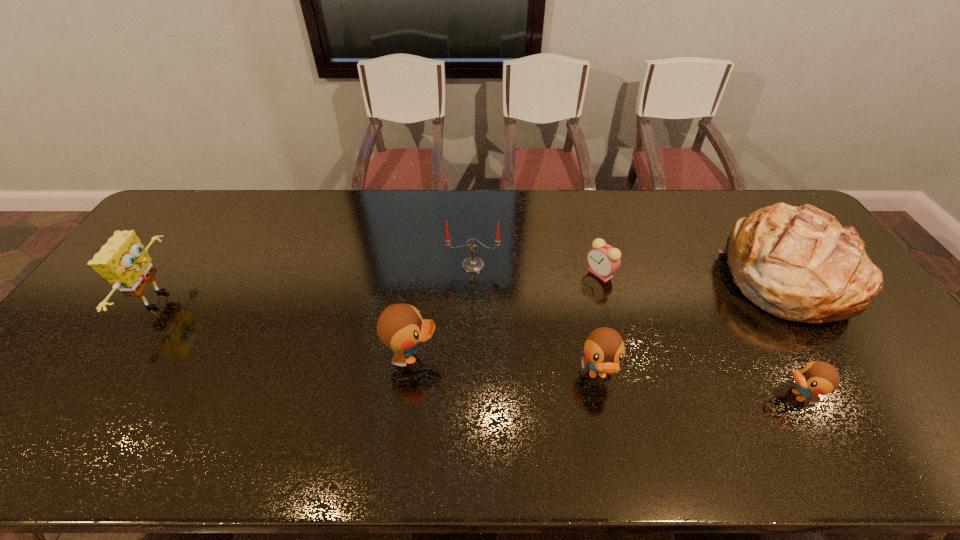
This screenshot has width=960, height=540. Identify the location of vacant area between the leftmost object and the leftmost duck. (286, 328).

The image size is (960, 540). Find the location of `free space between the leftmost duck and the bread`. free space between the leftmost duck and the bread is located at coordinates (596, 314).

Locate an element on the screen. free space between the tallest duck and the leftmost object is located at coordinates (286, 328).

In order to click on unoccupied area between the alarm clock and the shortest duck in this screenshot , I will do `click(699, 334)`.

Find the location of a particular element. This screenshot has height=540, width=960. unoccupied area between the bread and the candle is located at coordinates (627, 269).

Find the location of `the fourth closest object relative to the second shortest duck`. the fourth closest object relative to the second shortest duck is located at coordinates (815, 378).

Select which object is the second closest to the tallest duck. Please provide its 2D coordinates. Your answer should be formatted as a tuple, i.e. [(x, y)], where the tuple contains the x and y coordinates of a point satisfying the conditions above.

[(604, 348)]

Identify which duck is located as the third nearest to the bread. Please provide its 2D coordinates. Your answer should be formatted as a tuple, i.e. [(x, y)], where the tuple contains the x and y coordinates of a point satisfying the conditions above.

[(400, 327)]

Find the location of `the second closest duck to the alarm clock`. the second closest duck to the alarm clock is located at coordinates pyautogui.click(x=815, y=378).

Locate an element on the screen. The image size is (960, 540). vacant space that satisfies the following two spatial constraints: 1. on the front-facing side of the candle; 2. on the face of the sponge is located at coordinates (472, 299).